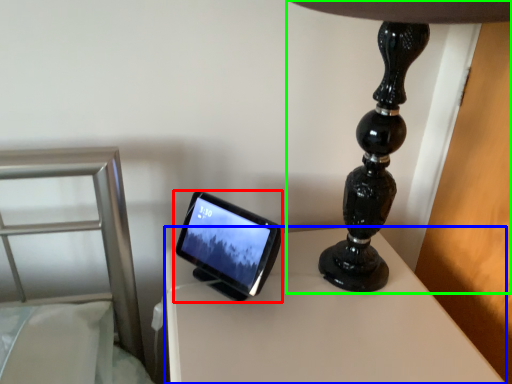
Question: Based on their relative distances, which object is farther from tablet computer (highlighted by a red box)? Choose from table (highlighted by a blue box) and lamp (highlighted by a green box).

Choices:
 (A) table
 (B) lamp

Answer: (B)